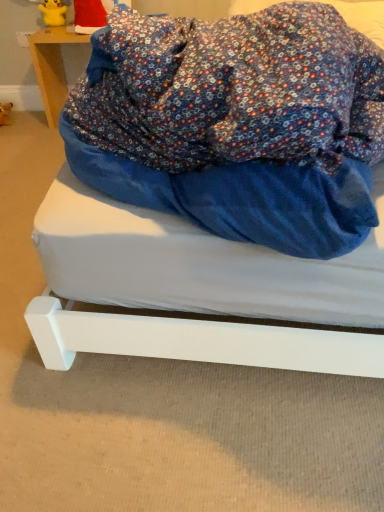
Question: Does santa hat at upper left touch white matte bed at center?

Choices:
 (A) yes
 (B) no

Answer: (B)

Question: Is santa hat at upper left shorter than white matte bed at center?

Choices:
 (A) yes
 (B) no

Answer: (B)

Question: From the image's perspective, does santa hat at upper left appear lower than white matte bed at center?

Choices:
 (A) yes
 (B) no

Answer: (B)

Question: Is santa hat at upper left far away from white matte bed at center?

Choices:
 (A) yes
 (B) no

Answer: (A)

Question: Is santa hat at upper left behind white matte bed at center?

Choices:
 (A) no
 (B) yes

Answer: (B)

Question: Does point (102, 6) appear closer or farther from the camera than point (352, 325)?

Choices:
 (A) closer
 (B) farther

Answer: (B)

Question: From a real-world perspective, is santa hat at upper left positioned above or below white matte bed at center?

Choices:
 (A) below
 (B) above

Answer: (B)

Question: From the image's perspective, relative to white matte bed at center, is santa hat at upper left above or below?

Choices:
 (A) above
 (B) below

Answer: (A)

Question: Based on their sizes in the image, would you say santa hat at upper left is bigger or smaller than white matte bed at center?

Choices:
 (A) big
 (B) small

Answer: (B)

Question: Which is correct: yellow rubber figurine at upper left is inside wooden table at upper left, or outside of it?

Choices:
 (A) outside
 (B) inside

Answer: (A)

Question: Looking at the image, does yellow rubber figurine at upper left seem bigger or smaller compared to wooden table at upper left?

Choices:
 (A) small
 (B) big

Answer: (A)

Question: Would you say yellow rubber figurine at upper left is to the left or to the right of wooden table at upper left in the picture?

Choices:
 (A) right
 (B) left

Answer: (B)

Question: From a real-world perspective, is yellow rubber figurine at upper left physically located above or below wooden table at upper left?

Choices:
 (A) below
 (B) above

Answer: (B)

Question: From the image's perspective, is white matte bed at center located above or below yellow rubber figurine at upper left?

Choices:
 (A) below
 (B) above

Answer: (A)

Question: Considering the relative positions of white matte bed at center and yellow rubber figurine at upper left in the image provided, is white matte bed at center to the left or to the right of yellow rubber figurine at upper left?

Choices:
 (A) right
 (B) left

Answer: (A)